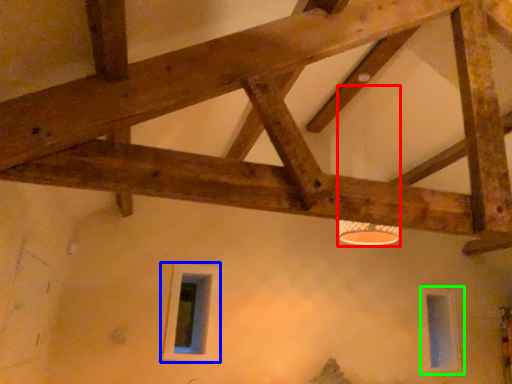
Question: Estimate the real-world distances between objects in this image. Which object is farther from lamp (highlighted by a red box), window (highlighted by a blue box) or window (highlighted by a green box)?

Choices:
 (A) window
 (B) window

Answer: (B)